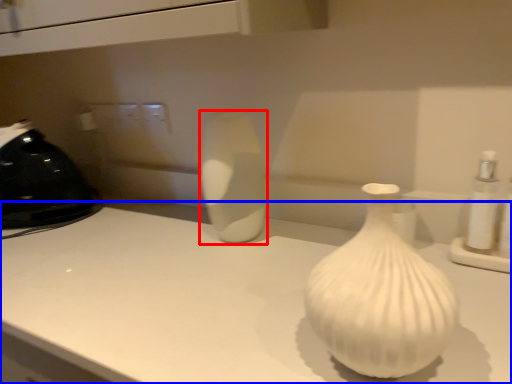
Question: Among these objects, which one is farthest to the camera, vase (highlighted by a red box) or counter top (highlighted by a blue box)?

Choices:
 (A) vase
 (B) counter top

Answer: (A)